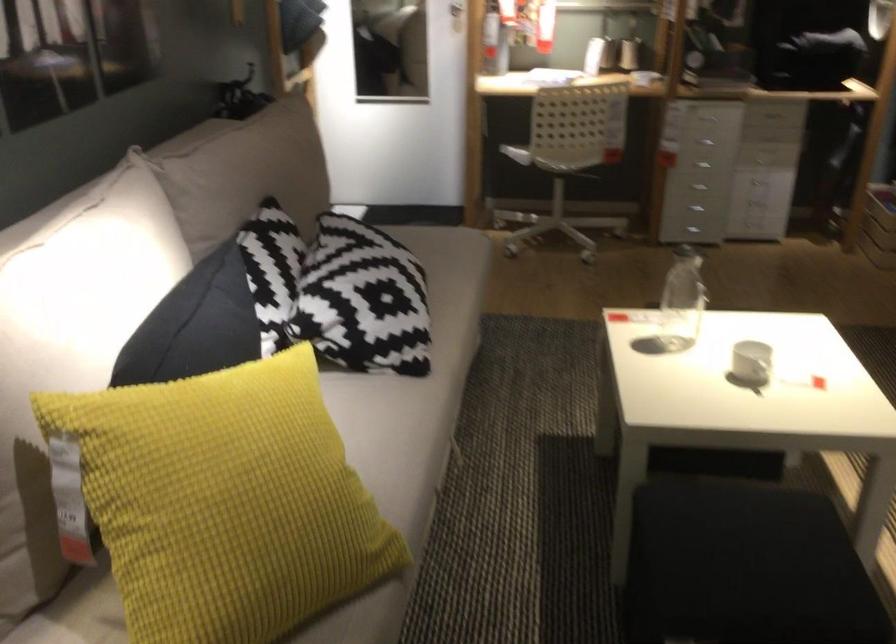
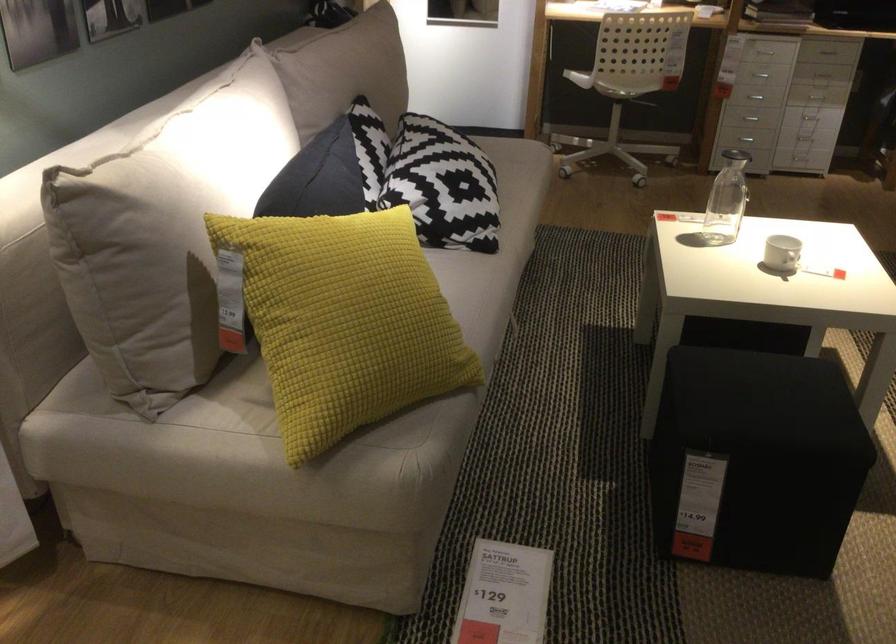
Locate, in the second image, the point that corresponds to the point at 362,305 in the first image.

(442, 185)